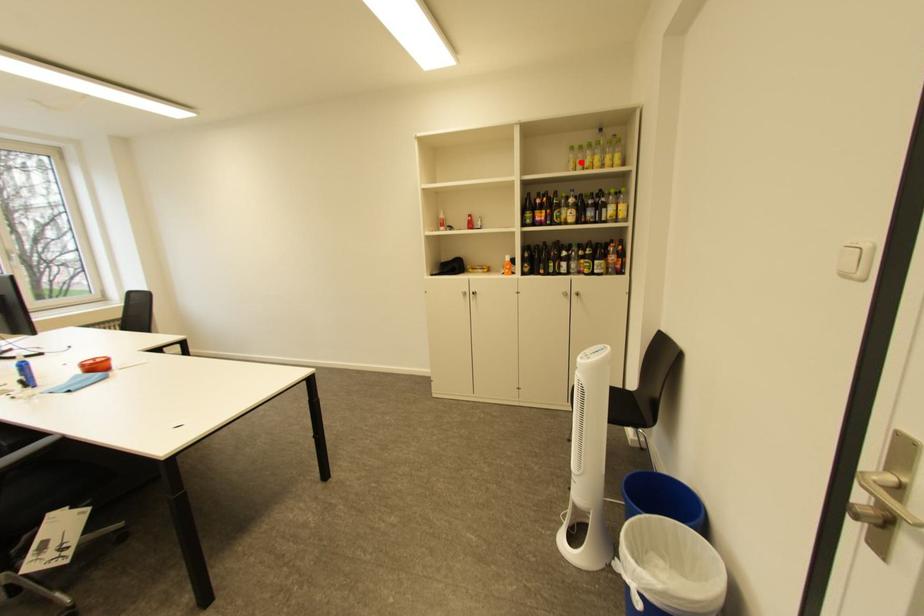
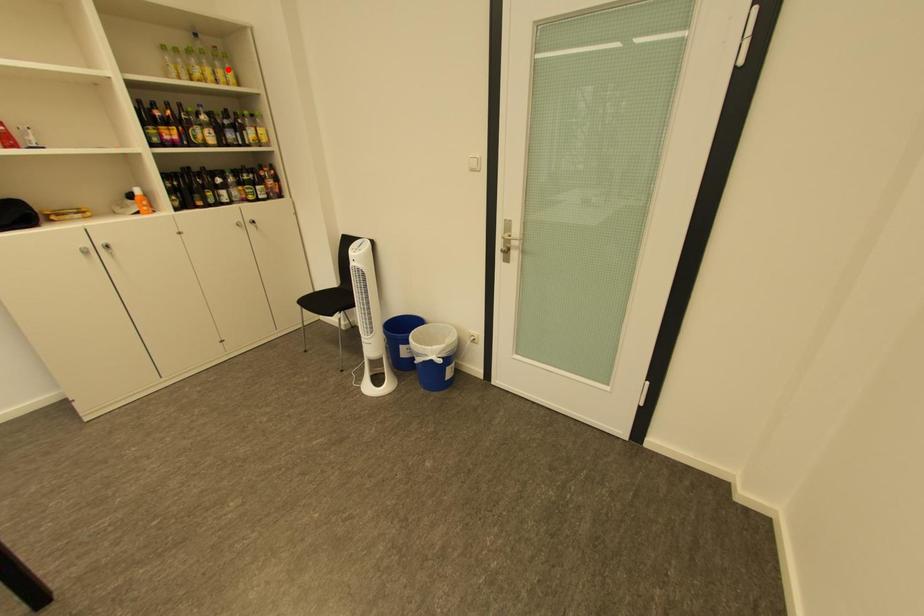
I am providing you with two images of the same scene from different viewpoints. A red point is marked on the first image and another point is marked on the second image. Is the marked point in image1 the same physical position as the marked point in image2?

No